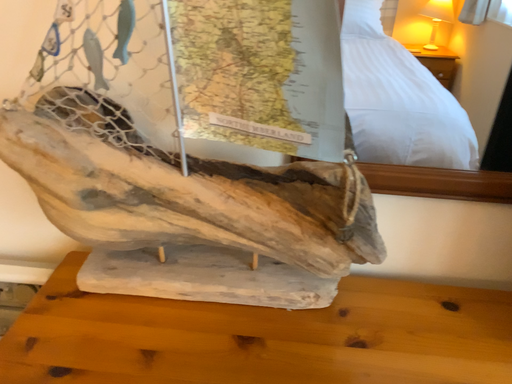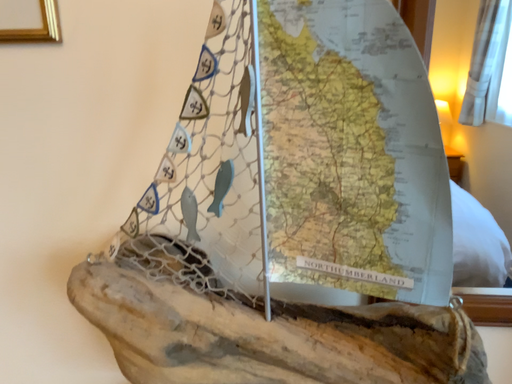
Question: Which way did the camera rotate in the video?

Choices:
 (A) rotated upward
 (B) rotated downward

Answer: (A)